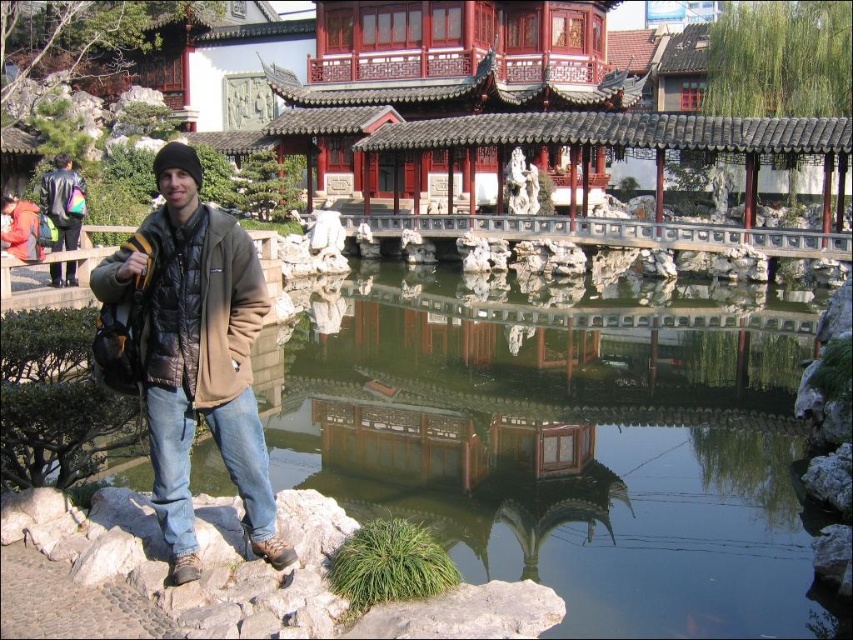
Question: Among these objects, which one is nearest to the camera?

Choices:
 (A) black knit hat at upper left
 (B) gray rock at lower left
 (C) transparent water at center

Answer: (B)

Question: Which object is closer to the camera taking this photo?

Choices:
 (A) brown fuzzy jacket at lower left
 (B) black knit hat at upper left

Answer: (A)

Question: Considering the real-world distances, which object is closest to the gray rock at lower left?

Choices:
 (A) matte black jacket at left
 (B) black knit hat at upper left
 (C) brown fuzzy jacket at lower left

Answer: (C)

Question: Is gray rock at lower left positioned behind matte black jacket at left?

Choices:
 (A) no
 (B) yes

Answer: (A)

Question: Is transparent water at center closer to camera compared to gray rock at lower left?

Choices:
 (A) no
 (B) yes

Answer: (A)

Question: Is brown fuzzy jacket at lower left positioned behind black knit hat at upper left?

Choices:
 (A) no
 (B) yes

Answer: (A)